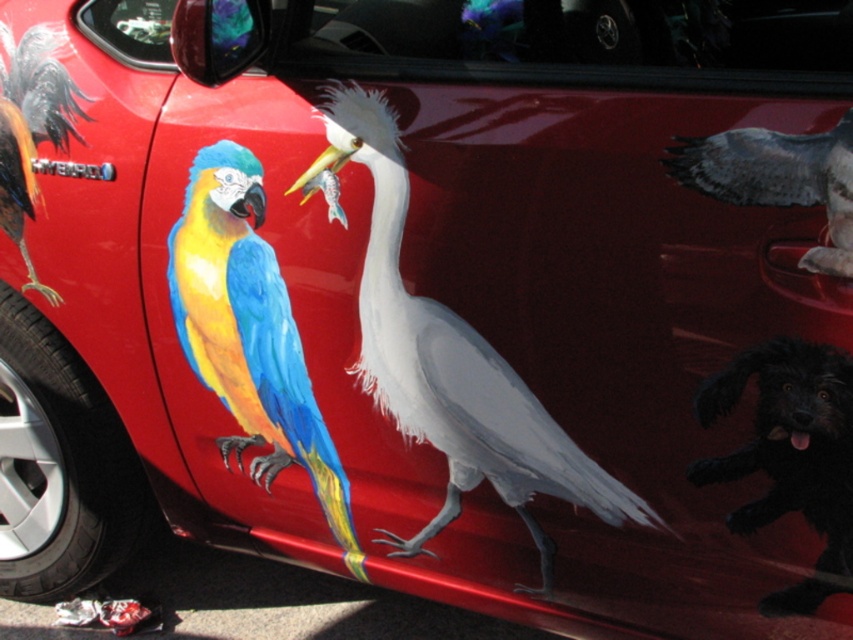
Question: Does white matte bird at center have a lesser width compared to black fuzzy dog at lower right?

Choices:
 (A) yes
 (B) no

Answer: (B)

Question: Based on their relative distances, which object is nearer to the shiny multicolored parrot at left?

Choices:
 (A) speckled feathered bird at upper right
 (B) shiny metallic rooster at upper left
 (C) black fuzzy dog at lower right

Answer: (B)

Question: Which point is farther from the camera taking this photo?

Choices:
 (A) (805, 401)
 (B) (264, 212)
 (C) (492, 394)

Answer: (B)

Question: Estimate the real-world distances between objects in this image. Which object is farther from the speckled feathered bird at upper right?

Choices:
 (A) white matte bird at center
 (B) shiny metallic rooster at upper left

Answer: (B)

Question: Does speckled feathered bird at upper right have a greater width compared to shiny metallic rooster at upper left?

Choices:
 (A) yes
 (B) no

Answer: (A)

Question: Does white matte bird at center have a lesser width compared to black fuzzy dog at lower right?

Choices:
 (A) no
 (B) yes

Answer: (A)